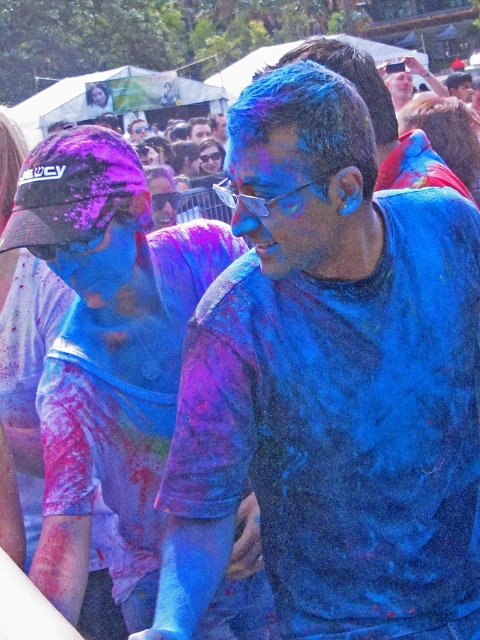
Question: Is matte blue shirt at center wider than blue matte face paint at center?

Choices:
 (A) yes
 (B) no

Answer: (B)

Question: Which point is farther to the camera?

Choices:
 (A) blue matte face paint at center
 (B) matte blue shirt at center

Answer: (A)

Question: Can you confirm if blue matte shirt at center is positioned above blue matte face paint at center?

Choices:
 (A) no
 (B) yes

Answer: (A)

Question: Which point is closer to the camera?

Choices:
 (A) (66, 534)
 (B) (368, 109)
 (C) (237, 310)

Answer: (C)

Question: Which object is farther from the camera taking this photo?

Choices:
 (A) blue matte shirt at center
 (B) matte blue shirt at center

Answer: (B)

Question: Does blue matte shirt at center come behind matte blue shirt at center?

Choices:
 (A) yes
 (B) no

Answer: (B)